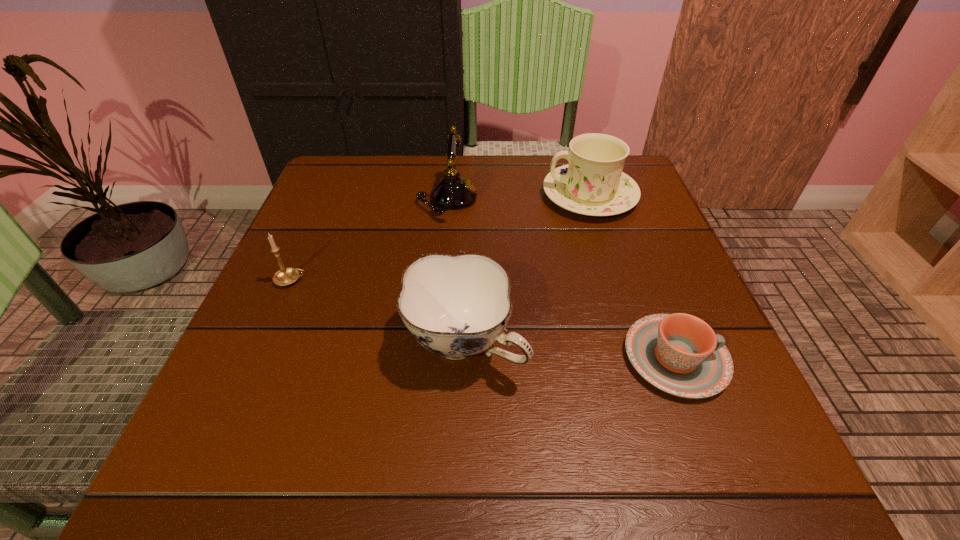
The height and width of the screenshot is (540, 960). I want to click on free point between the farthest chinaware and the telephone, so click(518, 197).

Where is `free space between the farthest chinaware and the telephone`? This screenshot has width=960, height=540. free space between the farthest chinaware and the telephone is located at coordinates (518, 197).

Locate an element on the screen. The height and width of the screenshot is (540, 960). the second closest object relative to the leftmost chinaware is located at coordinates (285, 276).

Identify the location of object identified as the third closest to the farthest chinaware. (680, 354).

The image size is (960, 540). In order to click on chinaware identified as the third closest to the telephone in this screenshot , I will do `click(680, 354)`.

Identify the location of chinaware that stands as the closest to the farthest chinaware. (456, 307).

Where is `free point that satisfies the following two spatial constraints: 1. on the dial of the telephone; 2. on the left side of the leftmost chinaware`? The height and width of the screenshot is (540, 960). free point that satisfies the following two spatial constraints: 1. on the dial of the telephone; 2. on the left side of the leftmost chinaware is located at coordinates (434, 343).

Image resolution: width=960 pixels, height=540 pixels. Identify the location of vacant space that satisfies the following two spatial constraints: 1. on the dial of the leftmost chinaware; 2. on the left side of the telephone. (434, 343).

This screenshot has width=960, height=540. I want to click on vacant position in the image that satisfies the following two spatial constraints: 1. on the handle side of the farthest chinaware; 2. on the front side of the leftmost chinaware, so click(x=636, y=343).